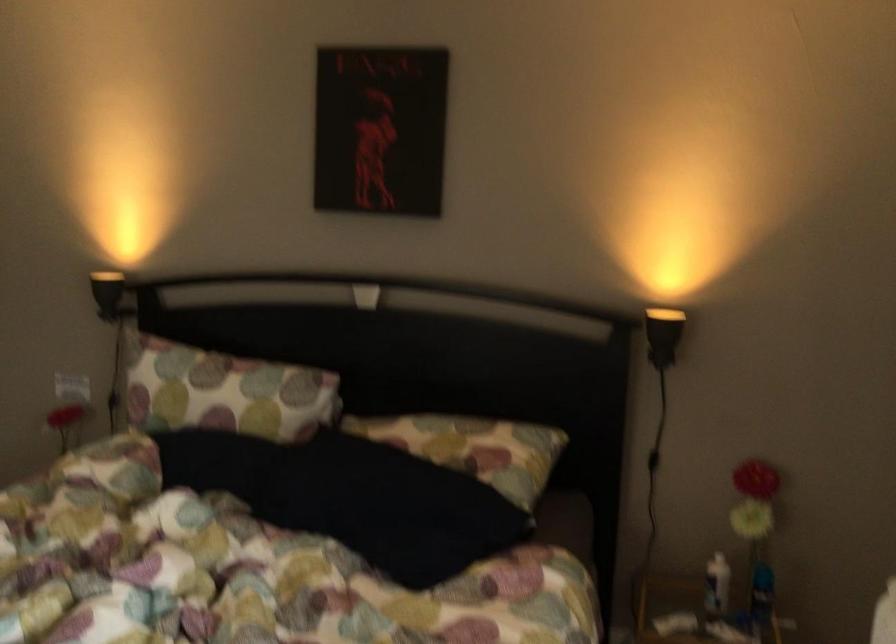
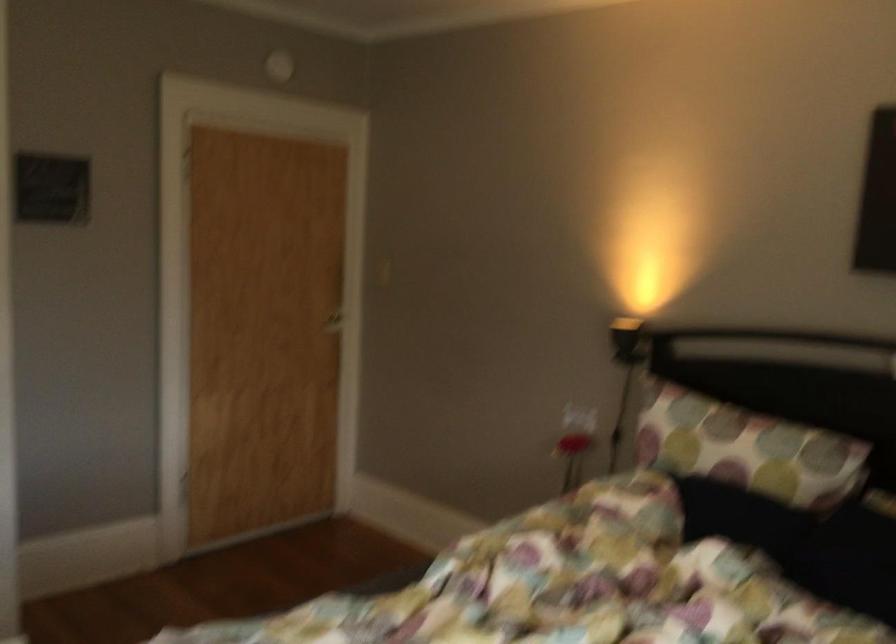
Where in the second image is the point corresponding to pixel 230 393 from the first image?

(746, 449)